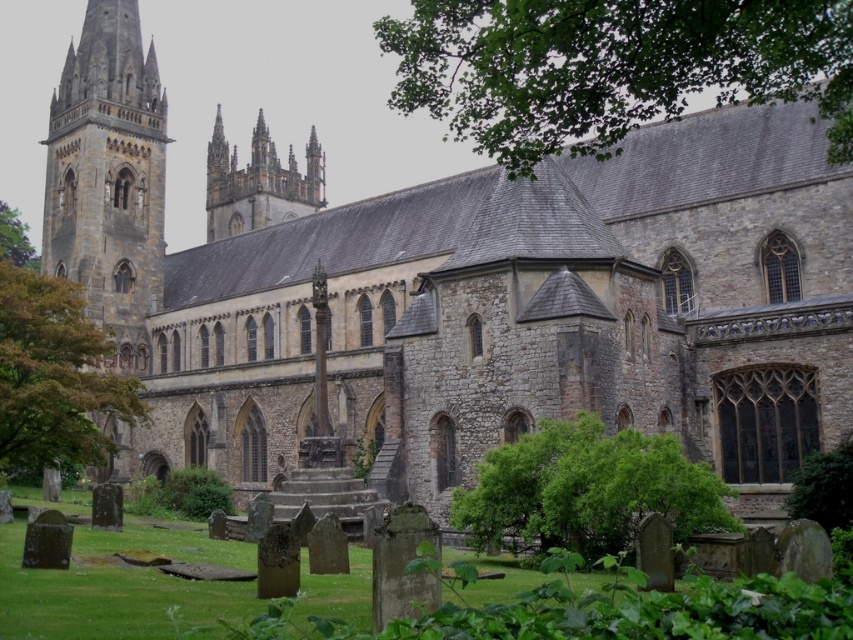
You are standing in front of the historic stone church and want to take a photo that includes both the stone tower at left and the green leafy tree at left. Which object should you position lower in your camera frame?

The green leafy tree at left should be positioned lower in your camera frame because the stone tower at left is located above it.